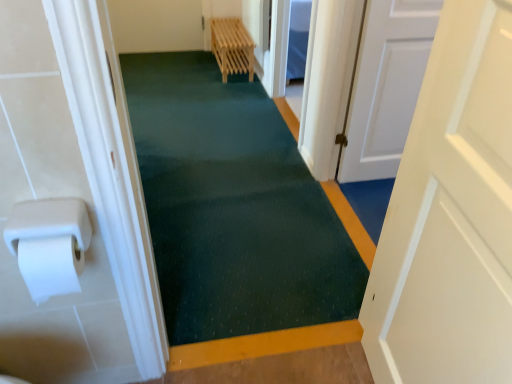
Question: Are white matte paper towel at left and white matte door at right, the second door when ordered from back to front, far apart?

Choices:
 (A) no
 (B) yes

Answer: (A)

Question: From the image's perspective, does white matte paper towel at left appear higher than white matte door at right, the second door when ordered from back to front?

Choices:
 (A) yes
 (B) no

Answer: (A)

Question: Is white matte paper towel at left to the right of white matte door at right, acting as the 1th door starting from the front, from the viewer's perspective?

Choices:
 (A) no
 (B) yes

Answer: (A)

Question: From a real-world perspective, is white matte paper towel at left on white matte door at right, which is the 1th door from left to right?

Choices:
 (A) yes
 (B) no

Answer: (A)

Question: Is white matte paper towel at left in front of white matte door at right, the second door when ordered from back to front?

Choices:
 (A) yes
 (B) no

Answer: (B)

Question: Is point (80, 261) closer or farther from the camera than point (188, 162)?

Choices:
 (A) closer
 (B) farther

Answer: (A)

Question: Considering the positions of white matte paper towel at left and green textured carpet at center in the image, is white matte paper towel at left taller or shorter than green textured carpet at center?

Choices:
 (A) short
 (B) tall

Answer: (B)

Question: Considering the positions of white matte paper towel at left and green textured carpet at center in the image, is white matte paper towel at left bigger or smaller than green textured carpet at center?

Choices:
 (A) big
 (B) small

Answer: (B)

Question: Is white matte paper towel at left situated inside green textured carpet at center or outside?

Choices:
 (A) outside
 (B) inside

Answer: (A)

Question: Looking at the image, does green textured carpet at center seem bigger or smaller compared to white matte door at right, the second door when ordered from back to front?

Choices:
 (A) small
 (B) big

Answer: (B)

Question: Considering the positions of green textured carpet at center and white matte door at right, which is the 1th door from left to right, in the image, is green textured carpet at center wider or thinner than white matte door at right, which is the 1th door from left to right,?

Choices:
 (A) wide
 (B) thin

Answer: (A)

Question: Is point 220,286 closer or farther from the camera than point 438,36?

Choices:
 (A) farther
 (B) closer

Answer: (A)

Question: Relative to white matte door at right, which is the 1th door from left to right, is green textured carpet at center in front or behind?

Choices:
 (A) front
 (B) behind

Answer: (B)

Question: Does point (20, 264) appear closer or farther from the camera than point (499, 294)?

Choices:
 (A) closer
 (B) farther

Answer: (B)

Question: Considering the positions of white matte paper towel at left and white matte door at right, acting as the 1th door starting from the front, in the image, is white matte paper towel at left wider or thinner than white matte door at right, acting as the 1th door starting from the front,?

Choices:
 (A) wide
 (B) thin

Answer: (B)